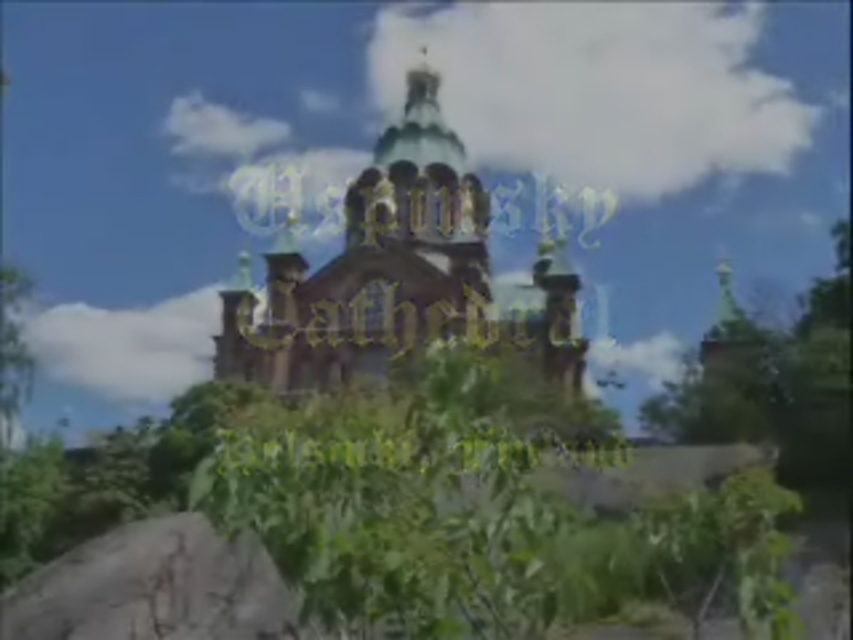
Is golden stone cathedral at center thinner than gray rough stone at lower left?

No, golden stone cathedral at center is not thinner than gray rough stone at lower left.

Who is shorter, golden stone cathedral at center or gray rough stone at lower left?

gray rough stone at lower left

Where is `golden stone cathedral at center`? This screenshot has width=853, height=640. golden stone cathedral at center is located at coordinates click(401, 275).

Locate an element on the screen. golden stone cathedral at center is located at coordinates (401, 275).